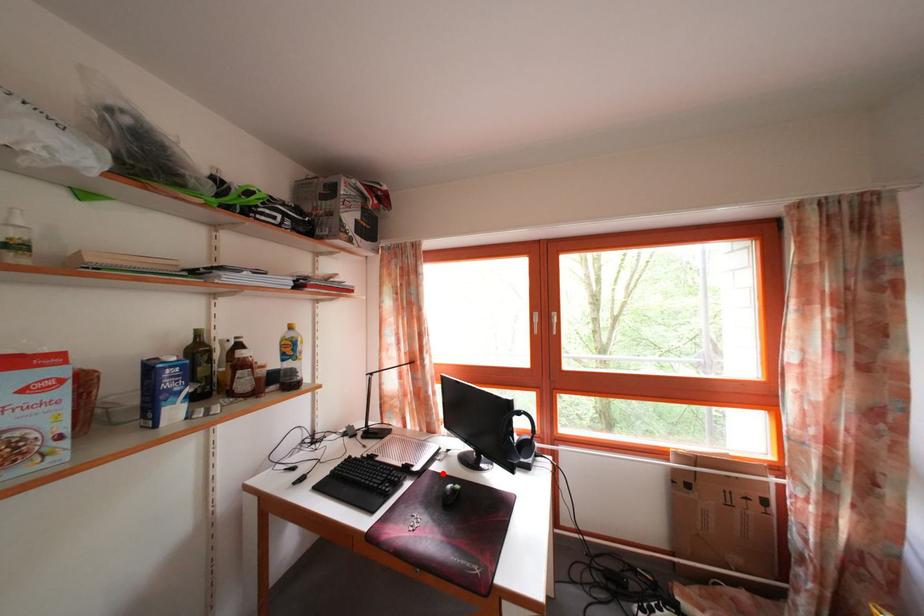
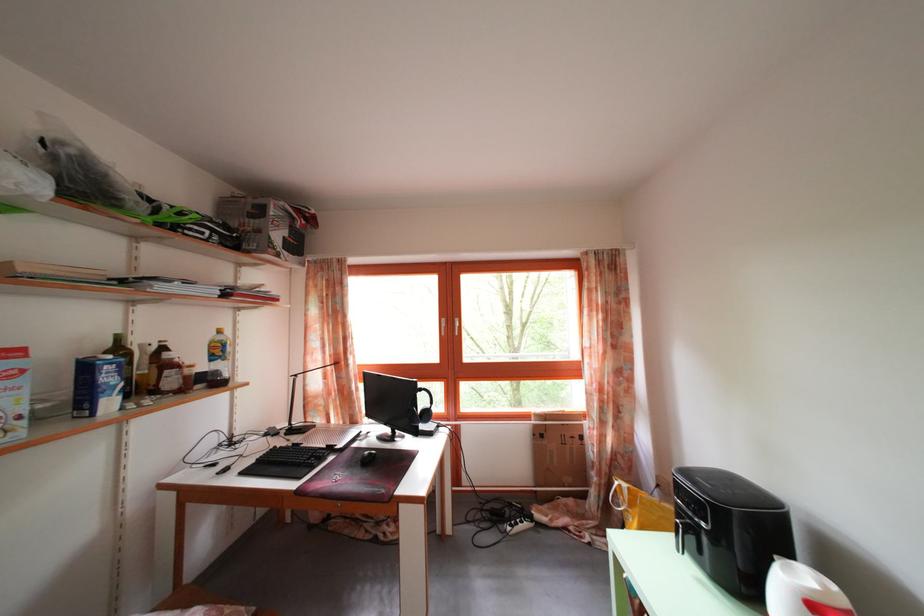
Where in the second image is the point corresponding to the highlighted location from the first image?

(363, 451)